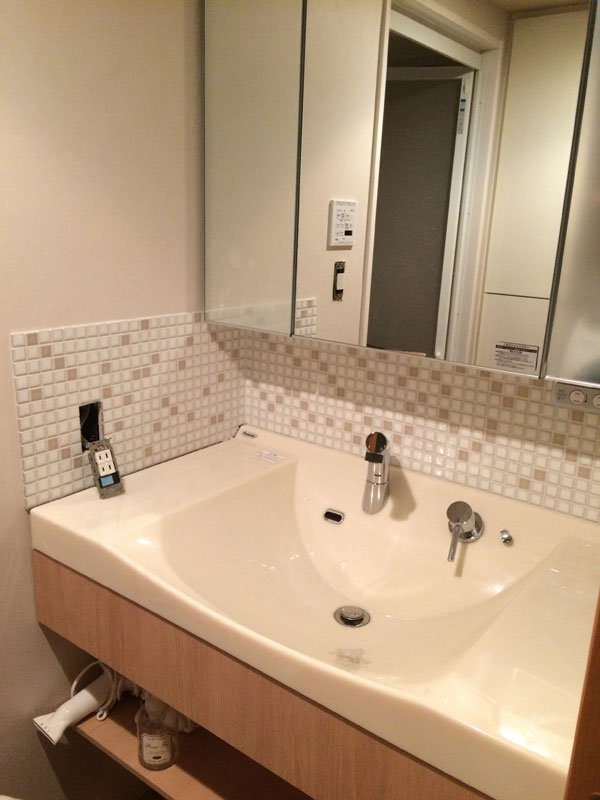
Image resolution: width=600 pixels, height=800 pixels. What are the coordinates of `handle` in the screenshot? It's located at (450, 534).